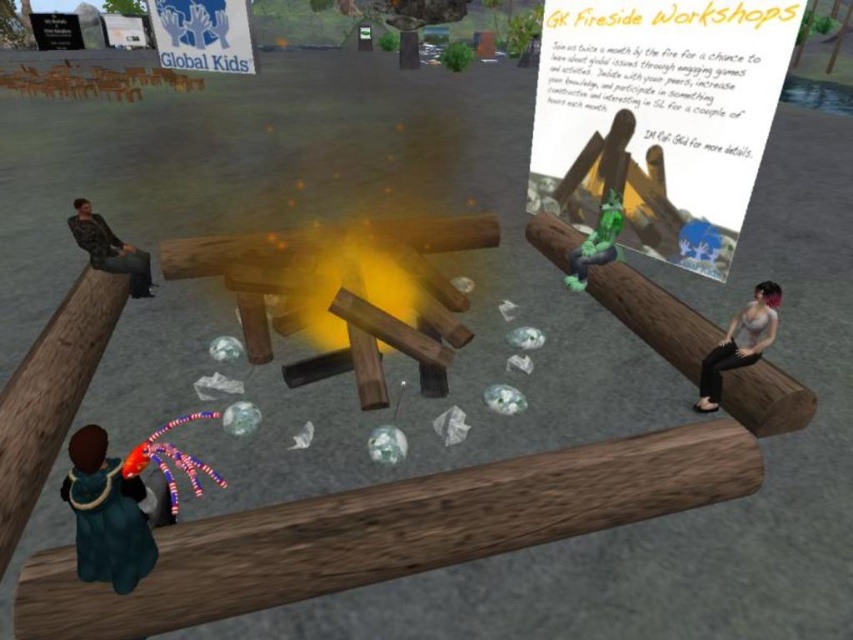
Can you confirm if brown wood beam at lower center is wider than leather jacket at left?

Correct, the width of brown wood beam at lower center exceeds that of leather jacket at left.

Image resolution: width=853 pixels, height=640 pixels. Identify the location of brown wood beam at lower center. (389, 531).

Can you confirm if leather jacket at left is smaller than green rubber figure at center?

Incorrect, leather jacket at left is not smaller in size than green rubber figure at center.

Measure the distance between leather jacket at left and camera.

leather jacket at left and camera are 4.60 meters apart.

Identify the location of leather jacket at left. (109, 248).

Which of these two, brown wood beam at lower left or brown wood log at right, stands shorter?

brown wood log at right

The height and width of the screenshot is (640, 853). I want to click on brown wood beam at lower left, so click(50, 396).